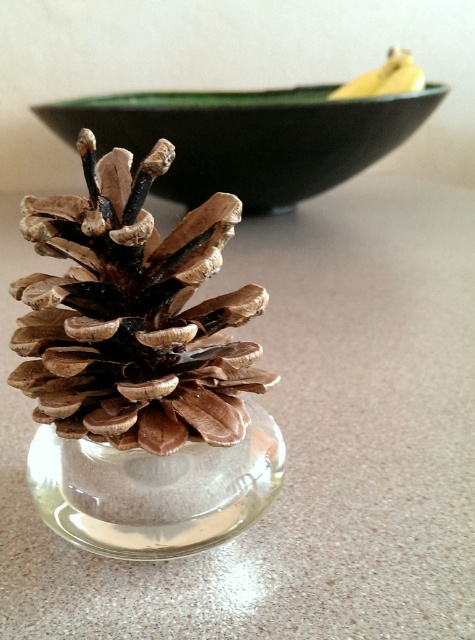
Looking at this image, you are arranging a centerpiece for a table and have the brown matte pinecone at center and the transparent glass vase at center. Which object takes up more space in the arrangement?

The brown matte pinecone at center has a larger size compared to the transparent glass vase at center, so it takes up more space in the arrangement.

You are arranging items on a table and need to place both the translucent glass table at center and the brown matte pinecone at center. According to the scene, which object is positioned higher?

The translucent glass table at center is located above the brown matte pinecone at center, so it is positioned higher.